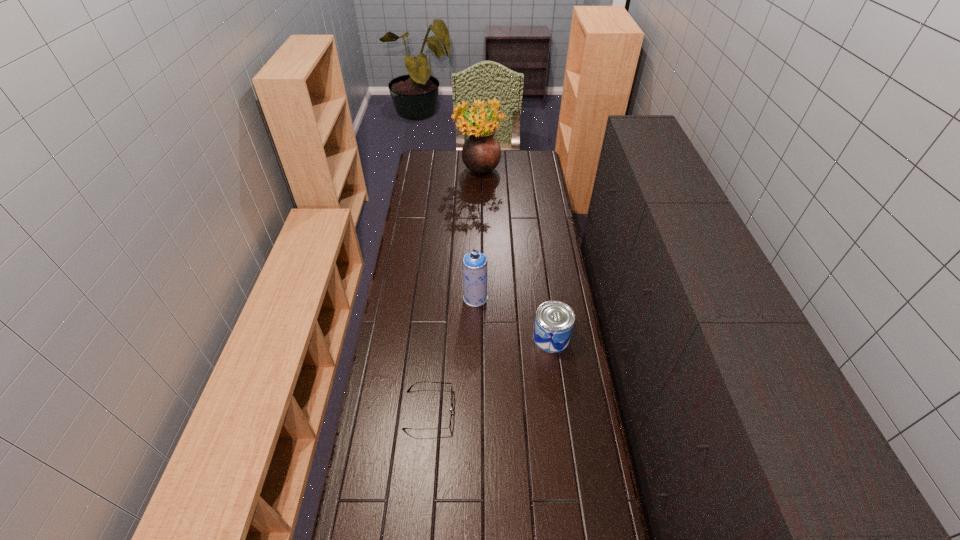
This screenshot has height=540, width=960. What are the coordinates of `unoccupied position between the farthest object and the spectacles` in the screenshot? It's located at (454, 292).

Locate an element on the screen. free space that is in between the farthest object and the second farthest object is located at coordinates (477, 235).

The height and width of the screenshot is (540, 960). In order to click on free spot between the second farthest object and the can in this screenshot , I will do `click(514, 318)`.

Identify the location of free area in between the spectacles and the tallest object. tap(454, 292).

The image size is (960, 540). Identify the location of free space between the farthest object and the spectacles. (454, 292).

I want to click on empty space between the shortest object and the third nearest object, so click(x=452, y=354).

The width and height of the screenshot is (960, 540). Find the location of `free spot between the rightmost object and the shortest object`. free spot between the rightmost object and the shortest object is located at coordinates (491, 374).

The width and height of the screenshot is (960, 540). Identify the location of vacant space in between the flower arrangement and the nearest object. (454, 292).

What are the coordinates of `unoccupied position between the third shortest object and the can` in the screenshot? It's located at (514, 318).

The width and height of the screenshot is (960, 540). Identify the location of object that is the third closest to the aerosol can. (481, 153).